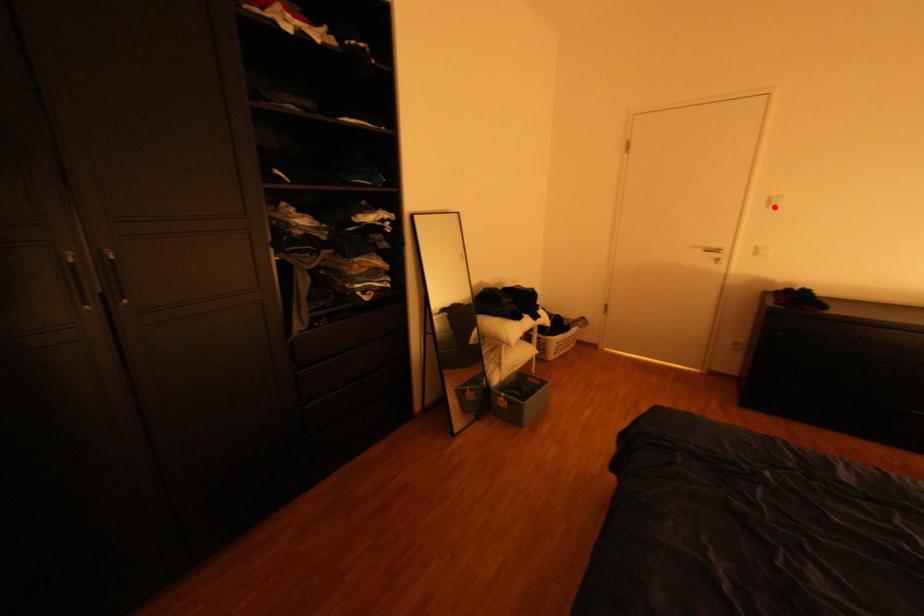
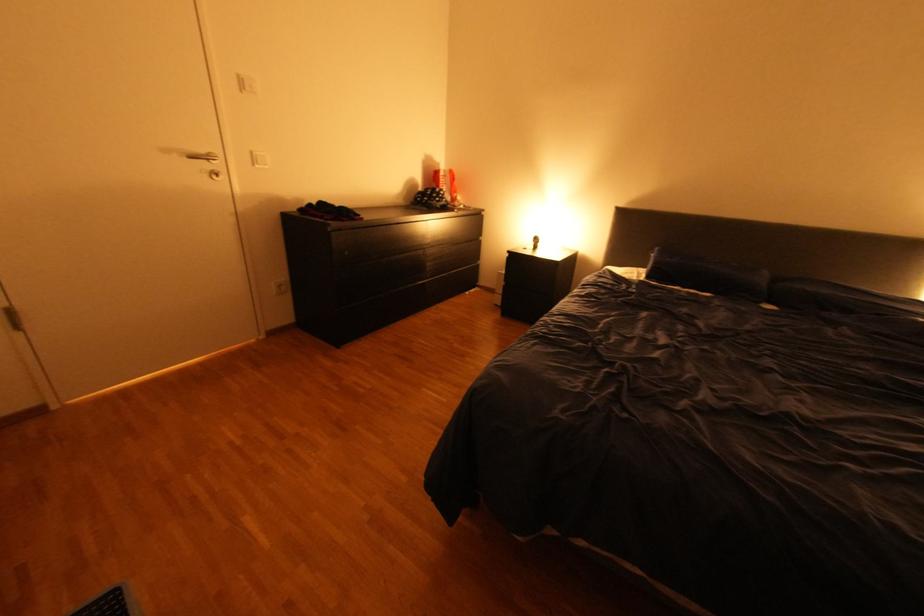
Locate, in the second image, the point that corresponds to the highlighted location in the first image.

(251, 91)